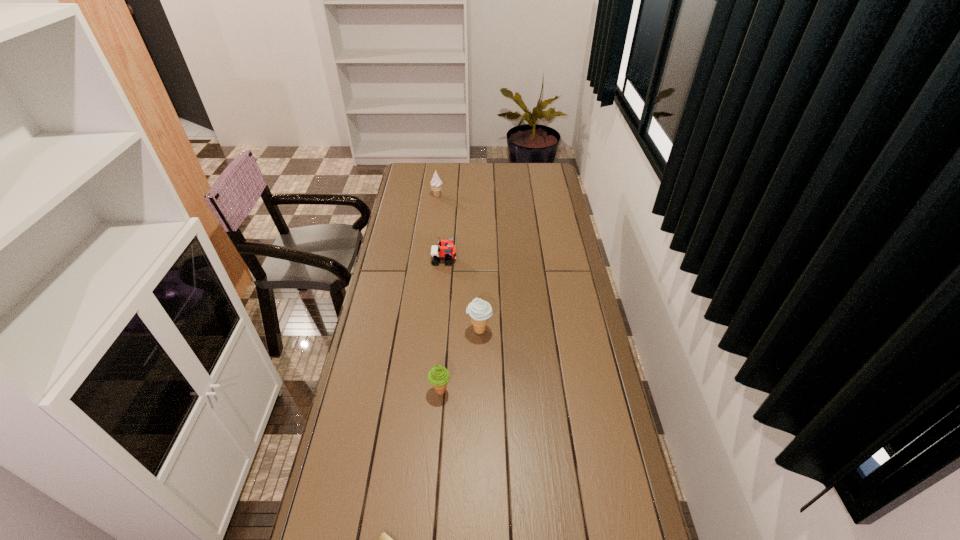
You are a GUI agent. You are given a task and a screenshot of the screen. Output one action in this format:
    pyautogui.click(x=<x>, y=<y>)
    Task: Click on the free spot located 0.180m on the front of the second nearest object
    This screenshot has height=540, width=960.
    Given the screenshot: What is the action you would take?
    pyautogui.click(x=435, y=455)

Locate an element on the screen. This screenshot has height=540, width=960. vacant space located on the front-facing side of the Lego is located at coordinates (470, 260).

The height and width of the screenshot is (540, 960). In the image, there is a desktop. In order to click on blank space at the far edge in this screenshot , I will do `click(457, 180)`.

Locate an element on the screen. This screenshot has width=960, height=540. blank space at the left edge of the desktop is located at coordinates (373, 437).

Where is `vacant space at the right edge of the desktop`? vacant space at the right edge of the desktop is located at coordinates (587, 448).

Identify the location of vacant area at the far left corner. Image resolution: width=960 pixels, height=540 pixels. click(419, 173).

You are a GUI agent. You are given a task and a screenshot of the screen. Output one action in this format:
    pyautogui.click(x=<x>, y=<y>)
    Task: Click on the free space that is in between the third nearest object and the farthest icecream
    
    Given the screenshot: What is the action you would take?
    click(x=458, y=263)

Image resolution: width=960 pixels, height=540 pixels. In order to click on free spot between the nearest icecream and the Lego in this screenshot , I will do `click(443, 325)`.

You are a GUI agent. You are given a task and a screenshot of the screen. Output one action in this format:
    pyautogui.click(x=<x>, y=<y>)
    Task: Click on the vacant region between the leftmost icecream and the second nearest object
    This screenshot has height=540, width=960.
    Given the screenshot: What is the action you would take?
    pyautogui.click(x=439, y=293)

Locate an element on the screen. The height and width of the screenshot is (540, 960). free area in between the second farthest object and the second icecream from left to right is located at coordinates (443, 325).